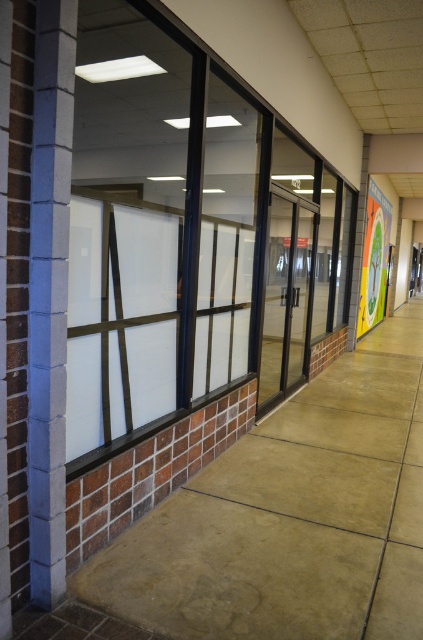
Does point (44, 100) come closer to viewer compared to point (282, 301)?

Yes, point (44, 100) is closer to viewer.

Between blue brick pillar at left and transparent glass door at center, which one is positioned higher?

transparent glass door at center is higher up.

Does point (43, 337) come behind point (260, 388)?

No, (43, 337) is in front of (260, 388).

The width and height of the screenshot is (423, 640). I want to click on blue brick pillar at left, so click(49, 294).